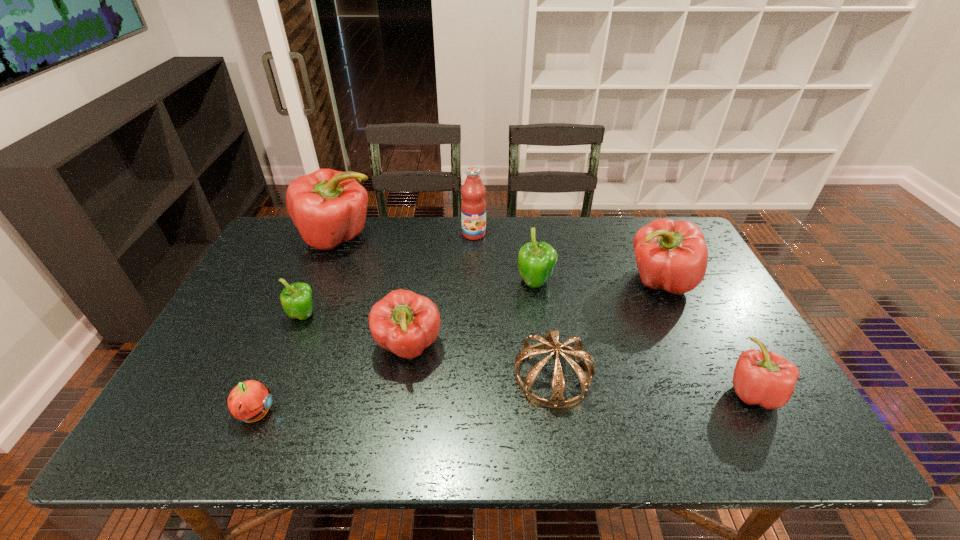
Identify the location of tiara. (550, 342).

I want to click on the smallest pink bell pepper, so click(764, 378).

This screenshot has width=960, height=540. I want to click on apple, so click(250, 400).

The height and width of the screenshot is (540, 960). Identify the location of free location located on the front of the biggest pink bell pepper. pos(324,274).

This screenshot has height=540, width=960. Identify the location of vacant space located on the front label of the fruit juice. (472, 320).

At what (x,y) coordinates should I click in order to perform the action: click on blank area located on the left of the third smallest pink bell pepper. Please return your answer as a coordinate pair (x, y). The image size is (960, 540). Looking at the image, I should click on (493, 282).

Where is `free space located on the front of the farther green bell pepper`? This screenshot has width=960, height=540. free space located on the front of the farther green bell pepper is located at coordinates (547, 374).

This screenshot has height=540, width=960. I want to click on vacant space located 0.190m on the back of the second smallest pink bell pepper, so click(x=420, y=276).

Locate an element on the screen. The height and width of the screenshot is (540, 960). vacant space situated on the front of the left green bell pepper is located at coordinates (287, 356).

In order to click on vacant space located 0.130m on the back of the brown tiara in this screenshot , I will do `click(542, 309)`.